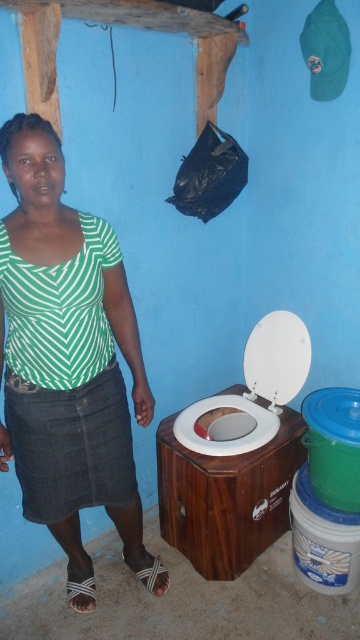
Question: Can you confirm if green striped shirt at upper left is positioned below white plastic toilet bowl at center?

Choices:
 (A) no
 (B) yes

Answer: (A)

Question: Which object appears closest to the camera in this image?

Choices:
 (A) green striped shirt at upper left
 (B) white plastic toilet bowl at center

Answer: (A)

Question: Is green striped shirt at upper left in front of white plastic toilet bowl at center?

Choices:
 (A) no
 (B) yes

Answer: (B)

Question: Is green striped shirt at upper left further to camera compared to white plastic toilet bowl at center?

Choices:
 (A) yes
 (B) no

Answer: (B)

Question: Which point is closer to the camera?

Choices:
 (A) white plastic toilet bowl at center
 (B) green striped shirt at upper left

Answer: (B)